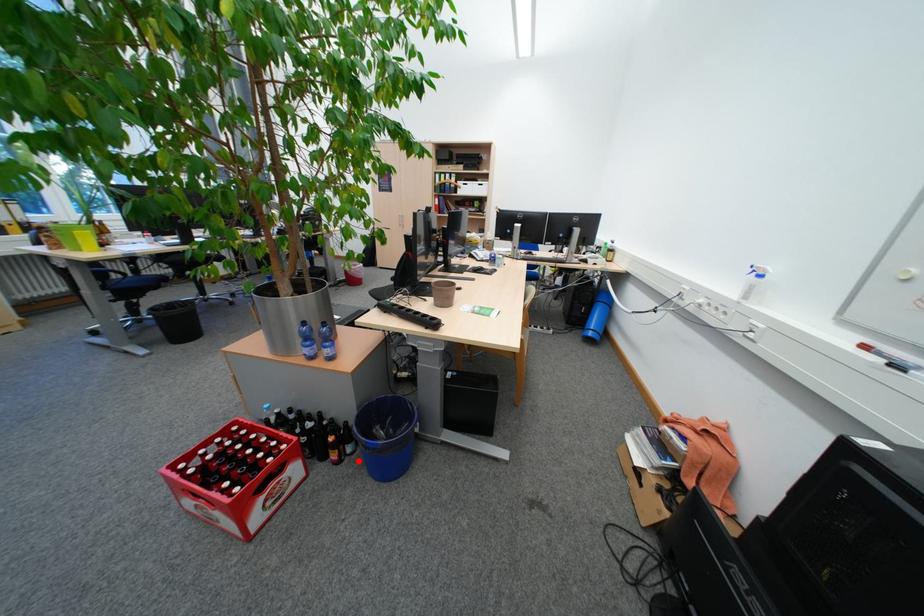
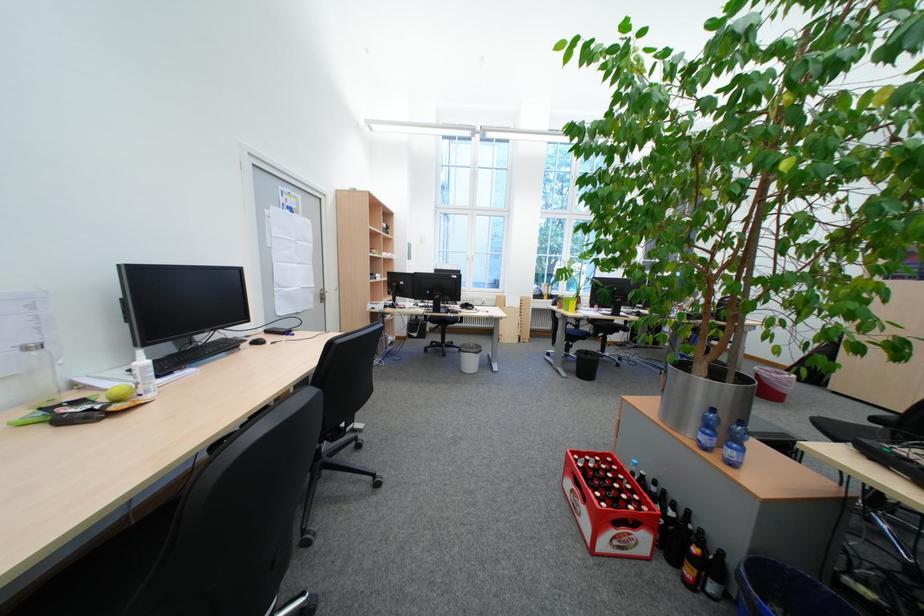
The point at the highlighted location is marked in the first image. Where is the corresponding point in the second image?

(714, 598)